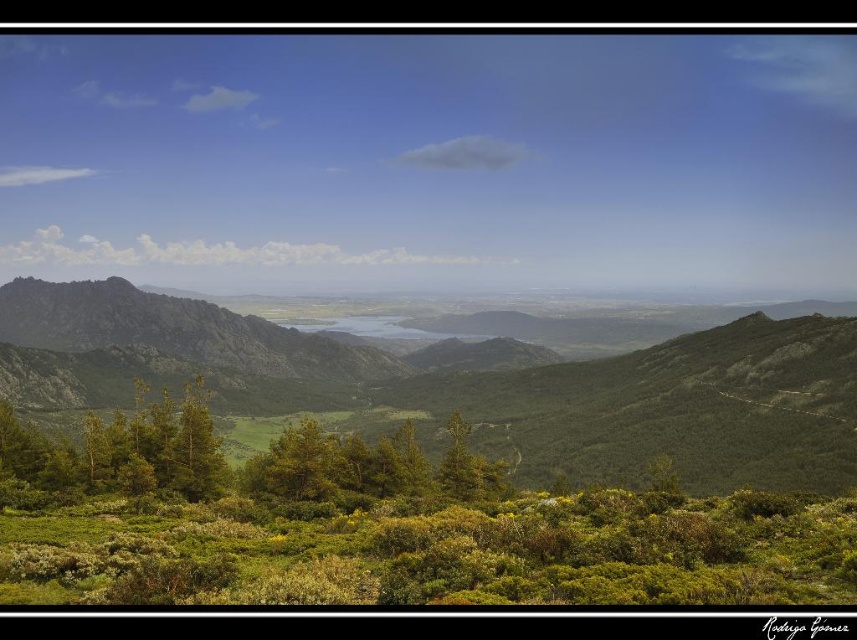
You are standing in the mountainous landscape and want to take a photo of both the green textured mountain range at center and the green leafy tree at center. Which object should you focus on first to ensure both are in the frame?

You should focus on the green textured mountain range at center first because it is closer to you than the green leafy tree at center, ensuring both are in the frame.

You are an environmental scientist analyzing the landscape. You need to determine which object occupies more visual space in the image. Based on the scene, which is larger between the green textured mountain range at center and the green matte tree at center?

The green textured mountain range at center is larger in size than the green matte tree at center, so it occupies more visual space in the image.